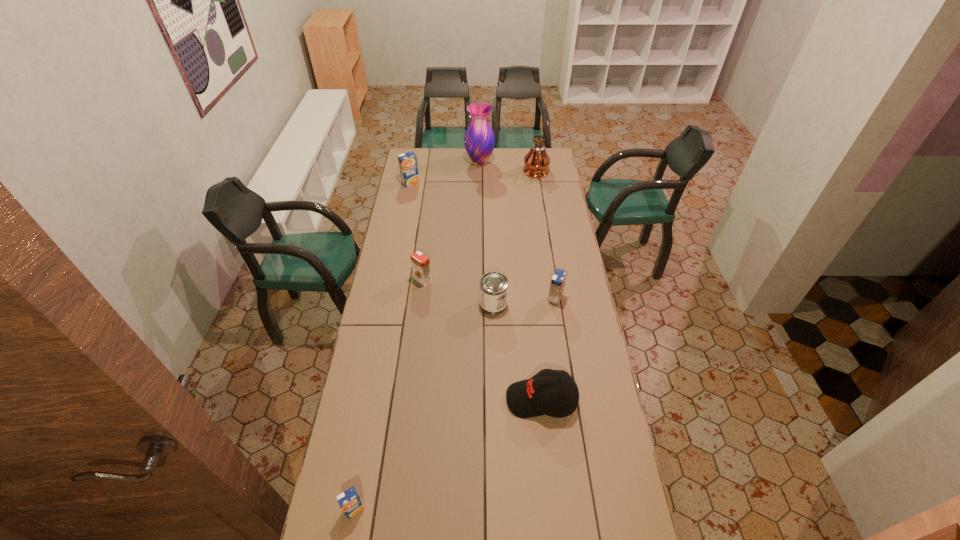
Locate an element on the screen. This screenshot has width=960, height=540. the seventh farthest object is located at coordinates (554, 393).

Where is `baseball cap`? baseball cap is located at coordinates (554, 393).

Where is `the nearest orange_juice`? The image size is (960, 540). the nearest orange_juice is located at coordinates (349, 501).

Locate an element on the screen. This screenshot has width=960, height=540. the shortest object is located at coordinates (349, 501).

You are a GUI agent. You are given a task and a screenshot of the screen. Output one action in this format:
    pyautogui.click(x=<x>, y=<y>)
    Task: Click on the free space located 0.250m on the left of the oil lamp
    Image resolution: width=960 pixels, height=540 pixels.
    Given the screenshot: What is the action you would take?
    pyautogui.click(x=481, y=173)

The image size is (960, 540). Identify the location of free space located 0.140m on the left of the vase. (442, 163).

I want to click on vacant space located on the front of the biggest blue orange_juice, so click(x=407, y=200).

This screenshot has width=960, height=540. In order to click on free space located on the left of the second nearest blue orange_juice in this screenshot , I will do `click(467, 299)`.

Find the location of a particular element. The width and height of the screenshot is (960, 540). vacant space situated 0.160m on the left of the second orange_juice from right to left is located at coordinates (378, 280).

At what (x,y) coordinates should I click in order to perform the action: click on vacant space positioned on the back of the can. Please return your answer as a coordinate pair (x, y). The image size is (960, 540). Looking at the image, I should click on (492, 253).